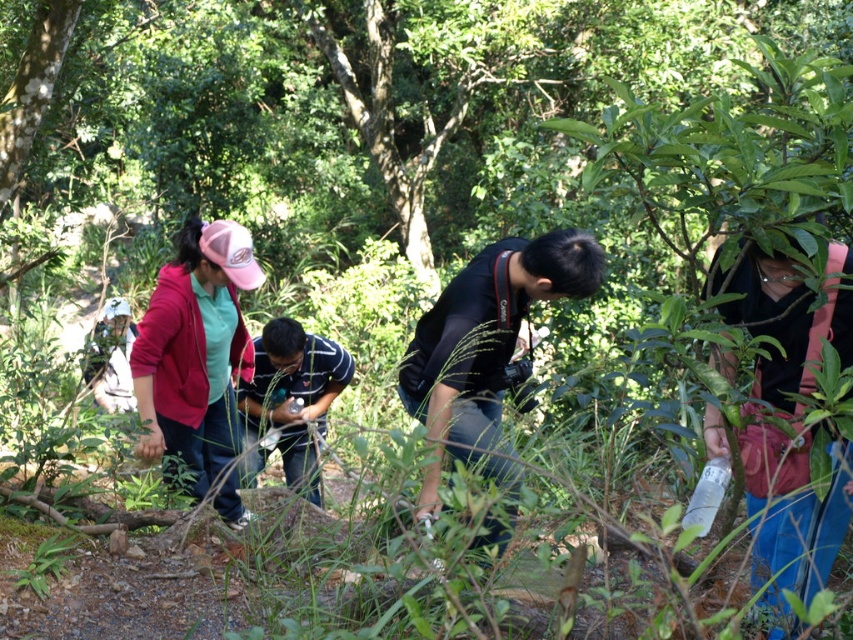
Which is behind, point (422, 64) or point (154, 294)?

Positioned behind is point (422, 64).

Locate an element on the screen. The image size is (853, 640). green leafy tree at center is located at coordinates (422, 83).

Is point (370, 22) behind point (256, 381)?

Yes, it is behind point (256, 381).

Can you confirm if green leafy tree at center is positioned to the left of striped cotton shirt at center?

Incorrect, green leafy tree at center is not on the left side of striped cotton shirt at center.

Which is behind, point (541, 19) or point (299, 417)?

Point (541, 19)

What are the coordinates of `green leafy tree at center` in the screenshot? It's located at (422, 83).

Is green leafy tree at center to the left of black matte camera at center from the viewer's perspective?

Yes, green leafy tree at center is to the left of black matte camera at center.

In the scene shown: Does green leafy tree at center come in front of black matte camera at center?

No, green leafy tree at center is behind black matte camera at center.

Who is more distant from viewer, (x=381, y=35) or (x=497, y=372)?

The point (x=381, y=35) is more distant.

What are the coordinates of `green leafy tree at center` in the screenshot? It's located at (422, 83).